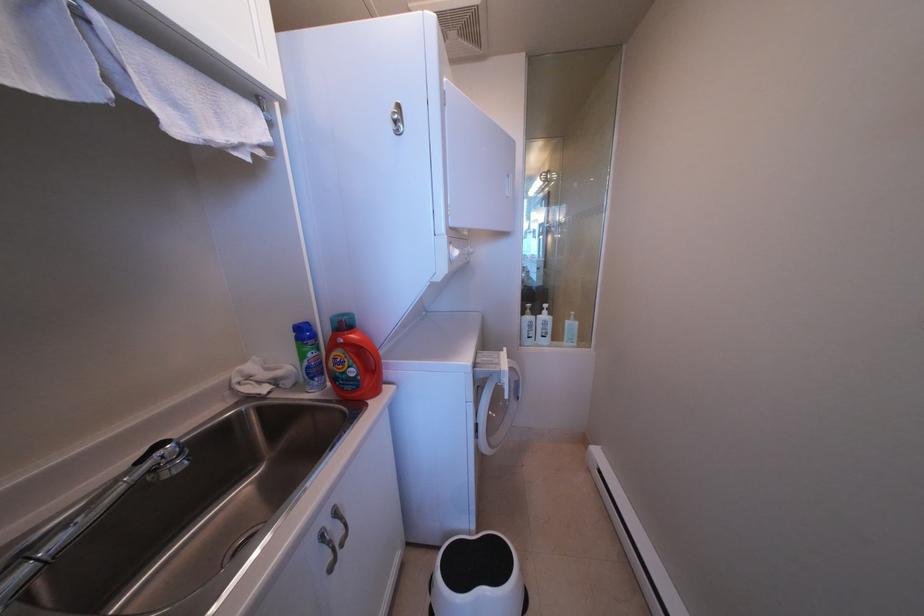
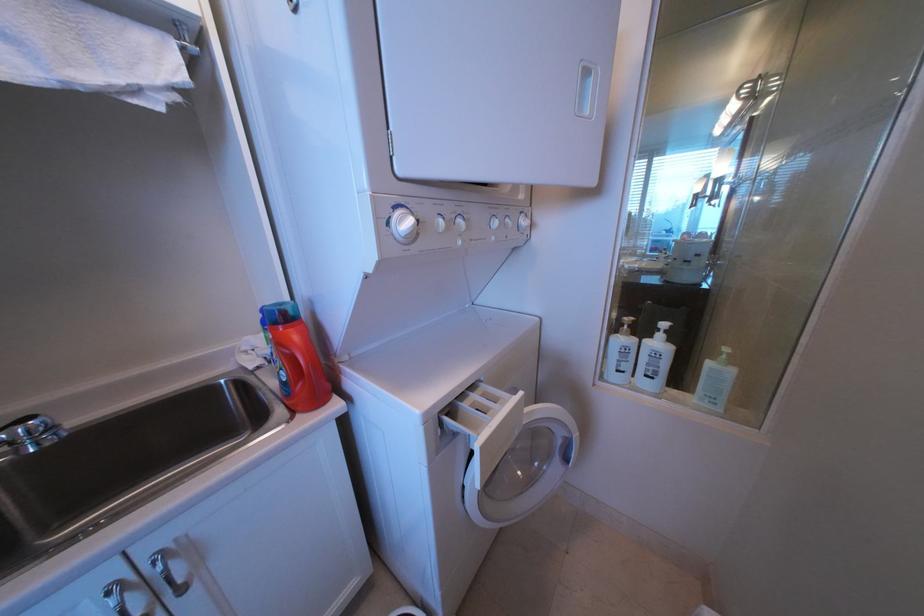
Question: Based on the continuous images, in which direction is the camera rotating? Reply with the corresponding letter.

Choices:
 (A) Left
 (B) Right
 (C) Up
 (D) Down

Answer: (A)